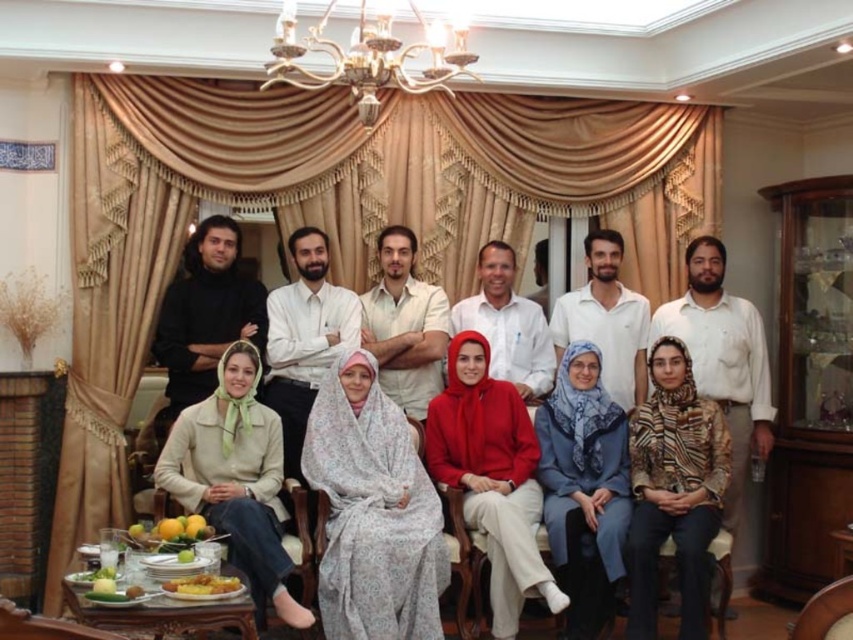
Who is taller, floral-patterned dress at center or gold metallic chandelier at upper center?

Standing taller between the two is floral-patterned dress at center.

Does floral-patterned dress at center have a greater width compared to gold metallic chandelier at upper center?

Yes.

Which is behind, point (633, 358) or point (364, 122)?

The point (633, 358) is behind.

Locate an element on the screen. Image resolution: width=853 pixels, height=640 pixels. floral-patterned dress at center is located at coordinates (621, 349).